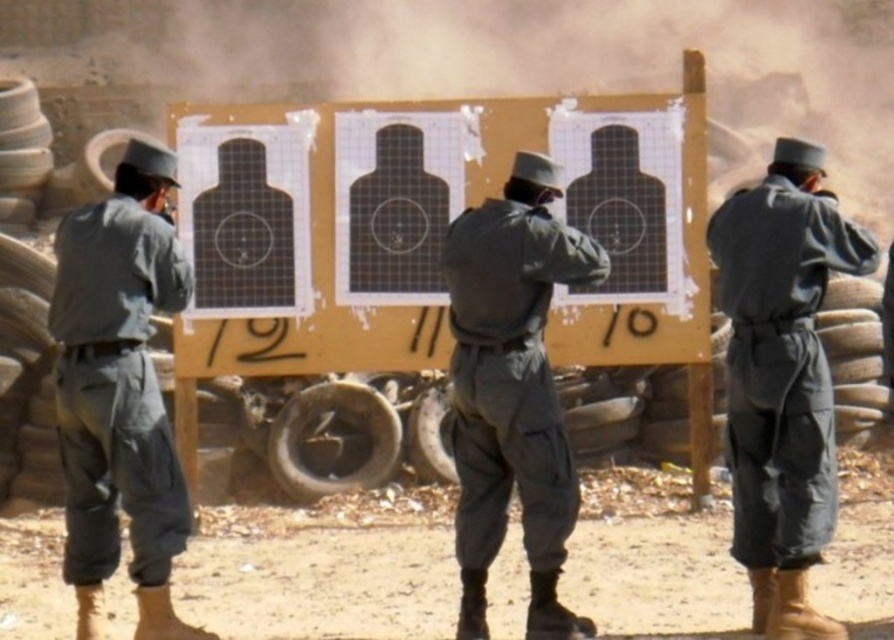
Does matte gray uniform at center have a lesser height compared to dark gray fabric uniform at left?

Yes, matte gray uniform at center is shorter than dark gray fabric uniform at left.

Is matte gray uniform at center closer to camera compared to dark gray fabric uniform at left?

That is True.

You are a GUI agent. You are given a task and a screenshot of the screen. Output one action in this format:
    pyautogui.click(x=<x>, y=<y>)
    Task: Click on the matte gray uniform at center
    This screenshot has height=640, width=894.
    Given the screenshot: What is the action you would take?
    pyautogui.click(x=782, y=378)

Is dark gray uniform at center above dark gray fabric uniform at left?

No.

In the scene shown: Is dark gray uniform at center positioned at the back of dark gray fabric uniform at left?

No, it is in front of dark gray fabric uniform at left.

Is point (470, 246) less distant than point (69, 392)?

That is False.

Locate an element on the screen. This screenshot has height=640, width=894. dark gray uniform at center is located at coordinates (512, 388).

Is point (779, 632) positioned in front of point (527, 264)?

Yes, point (779, 632) is in front of point (527, 264).

Image resolution: width=894 pixels, height=640 pixels. I want to click on matte gray uniform at center, so click(x=782, y=378).